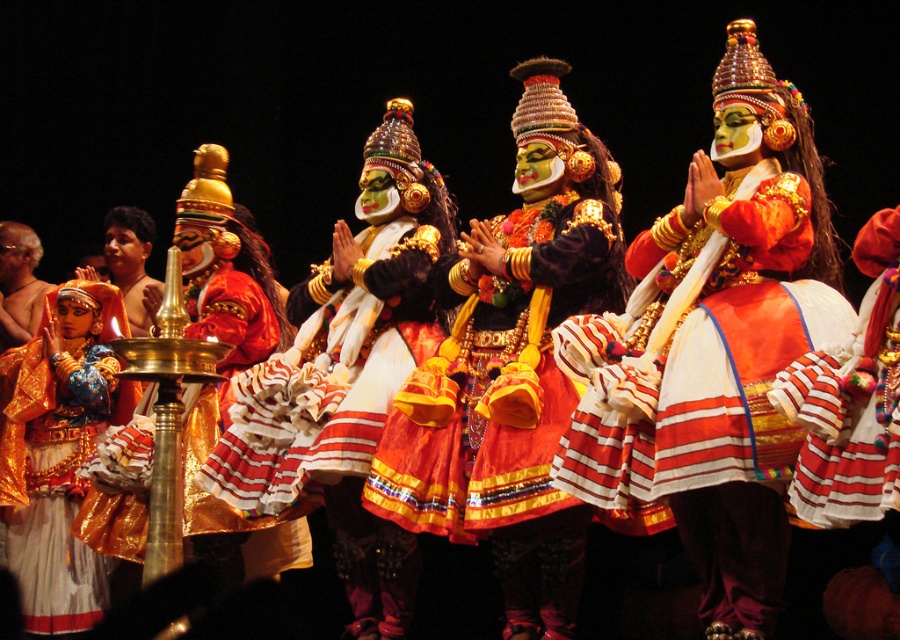
From the picture: You are a photographer setting up for a traditional Indian dance performance. You need to ensure that the shiny gold headdress at center and the matte gold ornament at left are both visible in your shot. Based on their positions and sizes, which object should you prioritize framing closer to the edge of the frame to avoid cropping?

The shiny gold headdress at center might be wider than matte gold ornament at left, so to avoid cropping, prioritize framing the shiny gold headdress at center closer to the edge of the frame since it is wider.

Based on the photo, you are standing in the audience watching the Kathakali performance. The stage is 250 feet away from you. You notice the matte orange fabric at center. Can you reach it by walking straight ahead?

The matte orange fabric at center is 230.09 feet away from the viewer. Since the stage is 250 feet away, you can reach it by walking straight ahead as it is within the stage area.

You are a photographer at the back of the stage during a Kathakali performance. You want to capture a closeup shot of the shiny gold headdress at center without the matte orange fabric at center showing in the background. Is this possible?

The matte orange fabric at center is below the shiny gold headdress at center, so if you position your camera to focus on the headdress and avoid the lower area, you can capture the headdress without the fabric in the background.